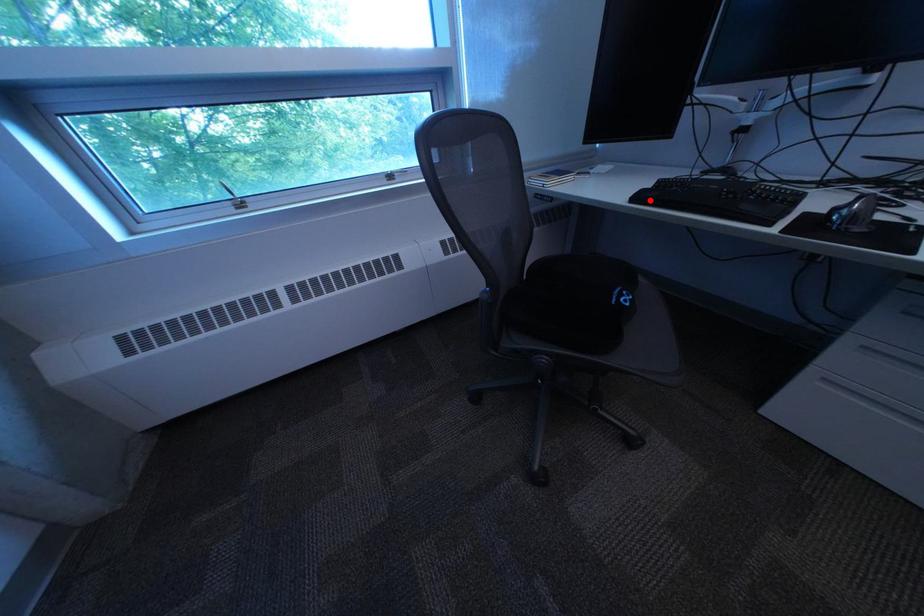
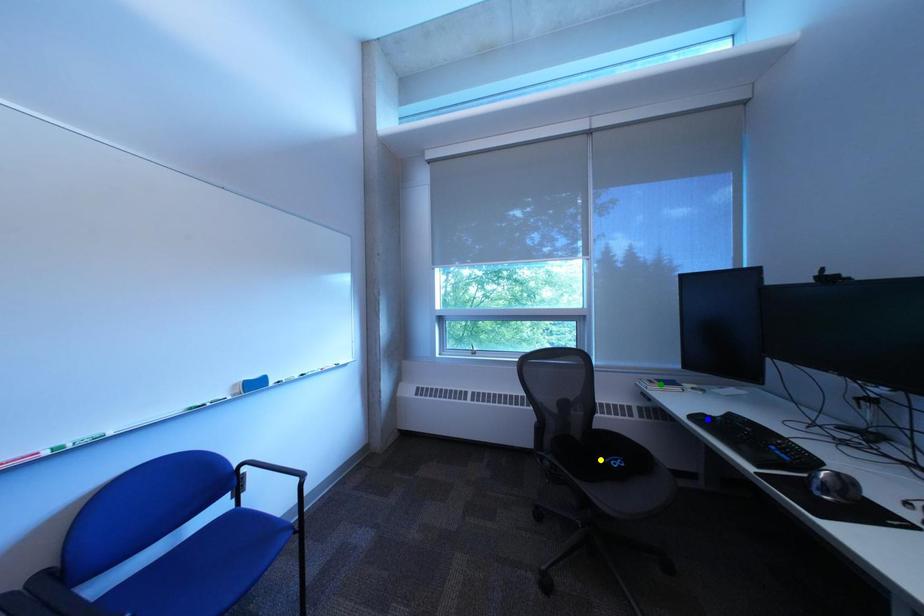
Question: I am providing you with two images of the same scene from different viewpoints. A red point is marked on the first image. You are given multiple points on the second image. Can you choose the point in image 2 that corresponds to the point in image 1?

Choices:
 (A) yellow point
 (B) green point
 (C) blue point

Answer: (C)